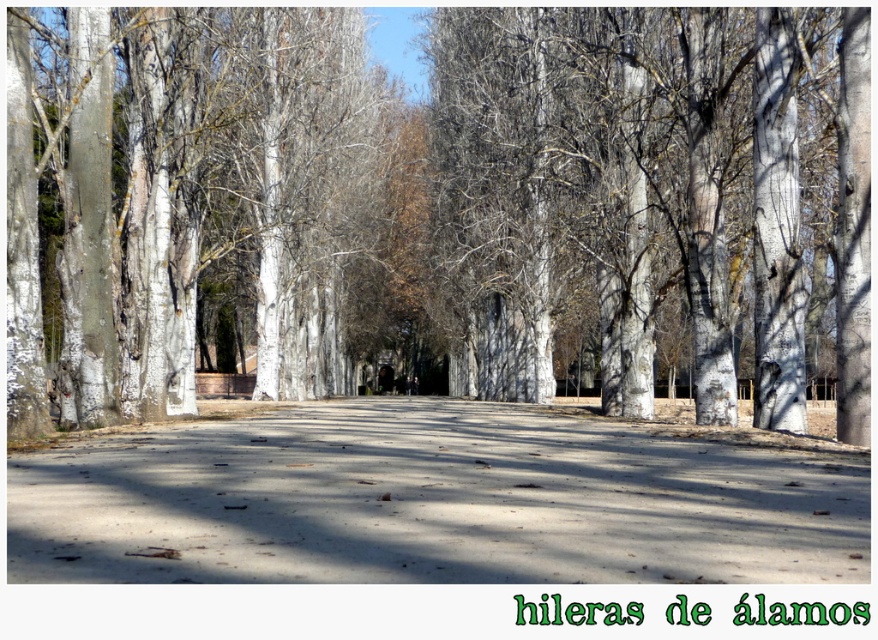
Question: Among these objects, which one is farthest from the camera?

Choices:
 (A) white smooth tree at left
 (B) smooth white tree at center
 (C) smooth concrete path at center

Answer: (A)

Question: Can you confirm if smooth white tree at center is thinner than smooth concrete path at center?

Choices:
 (A) no
 (B) yes

Answer: (A)

Question: Does smooth white tree at center lie behind white smooth tree at left?

Choices:
 (A) yes
 (B) no

Answer: (B)

Question: Among these objects, which one is nearest to the camera?

Choices:
 (A) white smooth tree at left
 (B) smooth white tree at center
 (C) smooth concrete path at center

Answer: (C)

Question: Which of the following is the farthest from the observer?

Choices:
 (A) white smooth tree at left
 (B) smooth white tree at center

Answer: (A)

Question: Observing the image, what is the correct spatial positioning of smooth white tree at center in reference to smooth concrete path at center?

Choices:
 (A) right
 (B) left

Answer: (A)